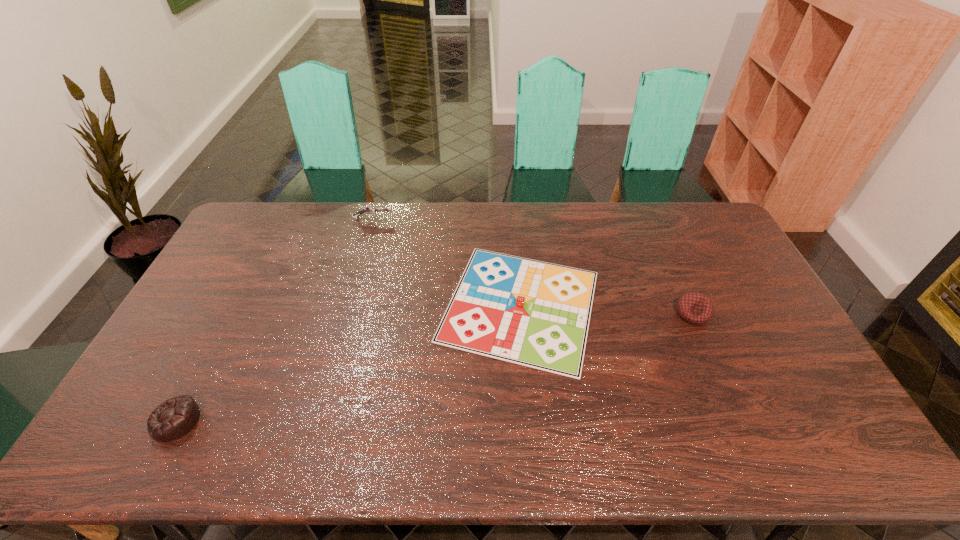
The width and height of the screenshot is (960, 540). I want to click on object that is the closest one to the second object from left to right, so click(532, 313).

At what (x,y) coordinates should I click in order to perform the action: click on the closest object relative to the farther beanbag. Please return your answer as a coordinate pair (x, y). The image size is (960, 540). Looking at the image, I should click on (532, 313).

Find the location of a particular element. vacant area that satisfies the following two spatial constraints: 1. aimed along the barrel of the second object from left to right; 2. on the back side of the farther beanbag is located at coordinates (347, 313).

Find the location of `vacant space that satisfies the following two spatial constraints: 1. on the back side of the shortest object; 2. on the right side of the left beanbag`. vacant space that satisfies the following two spatial constraints: 1. on the back side of the shortest object; 2. on the right side of the left beanbag is located at coordinates (236, 306).

Identify the location of free region that satisfies the following two spatial constraints: 1. aimed along the barrel of the gameboard; 2. on the right side of the gun. (348, 306).